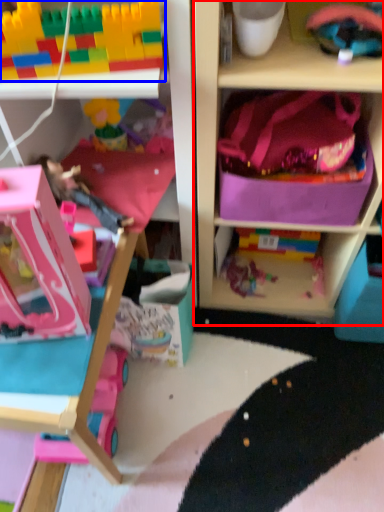
Question: Among these objects, which one is farthest to the camera, shelf (highlighted by a red box) or toy (highlighted by a blue box)?

Choices:
 (A) shelf
 (B) toy

Answer: (B)